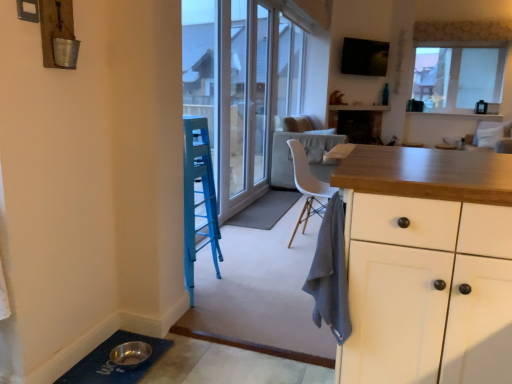
Question: Which direction should I rotate to look at gray fabric doormat at center, placed as the 1th doormat when sorted from back to front?

Choices:
 (A) right
 (B) left

Answer: (A)

Question: Is white fabric armchair at upper right thinner than gray cotton towel at center?

Choices:
 (A) no
 (B) yes

Answer: (A)

Question: Is white fabric armchair at upper right bigger than gray cotton towel at center?

Choices:
 (A) yes
 (B) no

Answer: (A)

Question: Is white fabric armchair at upper right behind gray cotton towel at center?

Choices:
 (A) no
 (B) yes

Answer: (B)

Question: Is white fabric armchair at upper right at the right side of gray cotton towel at center?

Choices:
 (A) no
 (B) yes

Answer: (B)

Question: From the image's perspective, does white fabric armchair at upper right appear lower than gray cotton towel at center?

Choices:
 (A) yes
 (B) no

Answer: (B)

Question: Does white fabric armchair at upper right have a greater height compared to gray cotton towel at center?

Choices:
 (A) no
 (B) yes

Answer: (B)

Question: Can you confirm if gray fabric doormat at center, marked as the 1th doormat in a top-to-bottom arrangement, is thinner than white glossy screen door at center?

Choices:
 (A) yes
 (B) no

Answer: (B)

Question: Does gray fabric doormat at center, placed as the 1th doormat when sorted from back to front, lie behind white glossy screen door at center?

Choices:
 (A) yes
 (B) no

Answer: (A)

Question: Is gray fabric doormat at center, arranged as the 2th doormat when viewed from the left, to the right of white glossy screen door at center from the viewer's perspective?

Choices:
 (A) no
 (B) yes

Answer: (B)

Question: Would you say gray fabric doormat at center, which is the 2th doormat from front to back, is outside white glossy screen door at center?

Choices:
 (A) no
 (B) yes

Answer: (B)

Question: From a real-world perspective, does gray fabric doormat at center, marked as the 1th doormat in a top-to-bottom arrangement, sit lower than white glossy screen door at center?

Choices:
 (A) yes
 (B) no

Answer: (A)

Question: Considering the relative sizes of gray fabric doormat at center, which is the 2th doormat from front to back, and white glossy screen door at center in the image provided, is gray fabric doormat at center, which is the 2th doormat from front to back, bigger than white glossy screen door at center?

Choices:
 (A) yes
 (B) no

Answer: (B)

Question: Considering the relative positions of white glossy screen door at center and transparent glass window at upper right in the image provided, is white glossy screen door at center to the left of transparent glass window at upper right from the viewer's perspective?

Choices:
 (A) no
 (B) yes

Answer: (B)